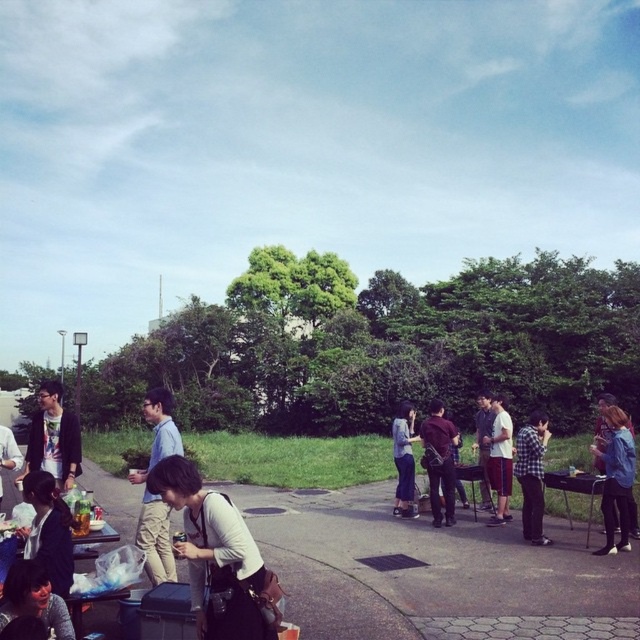
Question: Which point is closer to the camera?

Choices:
 (A) matte black jacket at left
 (B) khaki cotton pants at center
 (C) matte black jacket at lower left

Answer: (C)

Question: Which object appears closest to the camera in this image?

Choices:
 (A) dark brown leather jacket at center
 (B) white cotton shirt at center
 (C) matte black jacket at center
 (D) dark gray jacket at lower left

Answer: (C)

Question: Which object appears closest to the camera in this image?

Choices:
 (A) dark gray jacket at lower left
 (B) khaki cotton pants at center
 (C) denim jacket at lower right
 (D) checkered fabric shirt at center-right

Answer: (A)

Question: Is matte black jacket at left wider than denim pants at center?

Choices:
 (A) no
 (B) yes

Answer: (B)

Question: Can you confirm if khaki cotton pants at center is thinner than denim jacket at lower right?

Choices:
 (A) yes
 (B) no

Answer: (B)

Question: Is khaki cotton pants at center positioned before checkered fabric shirt at center-right?

Choices:
 (A) no
 (B) yes

Answer: (B)